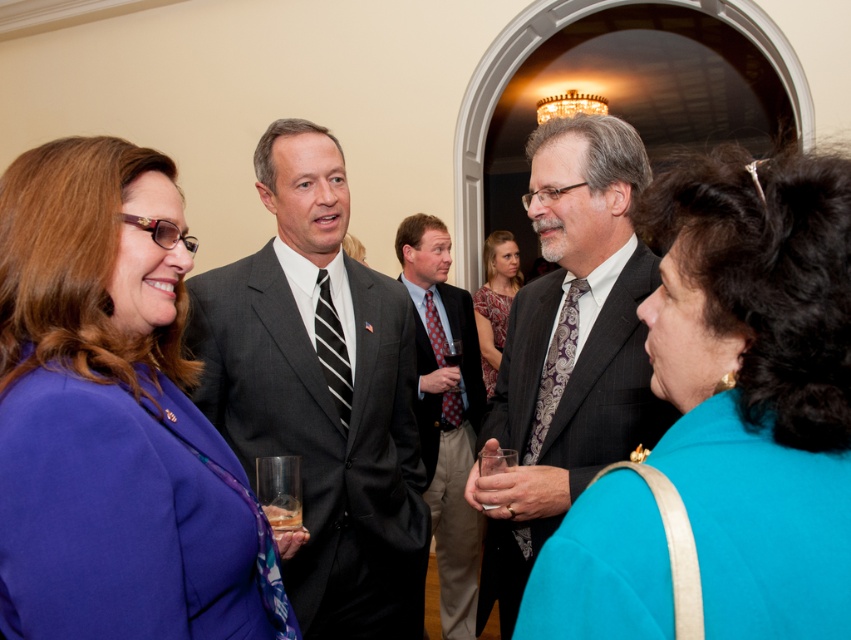
You are standing at the entrance of the room and want to move towards the two points marked in the image. Which point, point (712, 228) or point (566, 368), is closer to you?

Point (712, 228) is in front of point (566, 368), so it is closer to you.

You are a photographer at this event and want to ensure both the printed silk dress at center and the patterned silk tie at center are clearly visible in your photo. Given their sizes, which one might require more careful framing to avoid being too small in the shot?

The patterned silk tie at center is smaller in size compared to the printed silk dress at center, so it might require more careful framing to avoid being too small in the shot.

You are a photographer at the event and want to take a photo of the teal fabric purse at center and the purple paisley tie at center without any obstruction. Based on their positions, which object should you adjust to ensure both are visible clearly?

The teal fabric purse at center is in front of the purple paisley tie at center. To ensure both are visible clearly, you should move the teal fabric purse at center slightly backward or the purple paisley tie at center slightly forward so they are not overlapping.